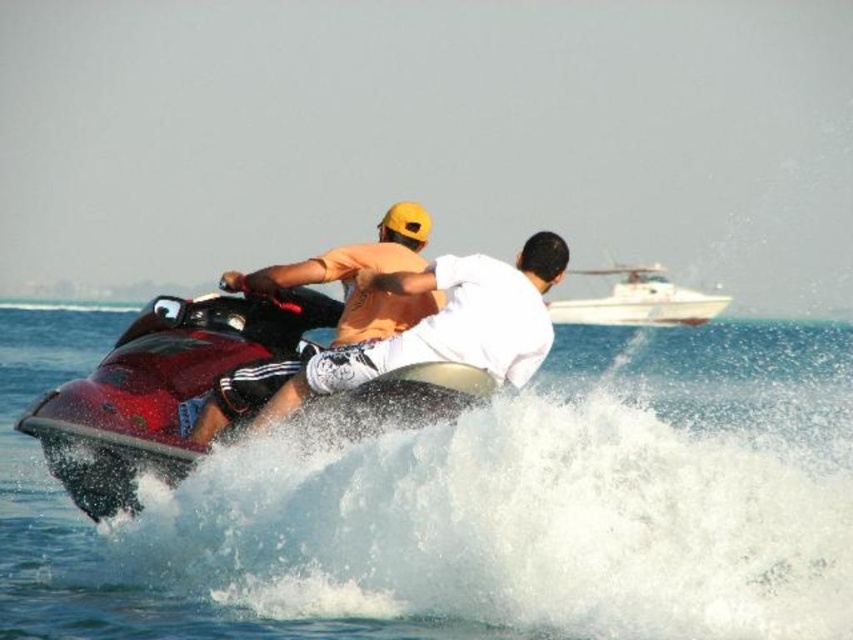
Question: From the image, what is the correct spatial relationship of shiny red jet ski at center in relation to matte orange helmet at upper center?

Choices:
 (A) above
 (B) below

Answer: (B)

Question: Which object is farther from the camera taking this photo?

Choices:
 (A) clear water at jet ski center
 (B) white glossy boat at upper center
 (C) matte orange helmet at upper center

Answer: (B)

Question: Can you confirm if matte orange helmet at upper center is wider than white glossy boat at upper center?

Choices:
 (A) yes
 (B) no

Answer: (B)

Question: Does clear water at jet ski center have a greater width compared to matte orange helmet at upper center?

Choices:
 (A) no
 (B) yes

Answer: (B)

Question: Which object is farther from the camera taking this photo?

Choices:
 (A) white glossy boat at upper center
 (B) shiny red jet ski at center
 (C) clear water at jet ski center
 (D) matte orange helmet at upper center

Answer: (A)

Question: Which of these objects is positioned closest to the clear water at jet ski center?

Choices:
 (A) white glossy boat at upper center
 (B) shiny red jet ski at center

Answer: (A)